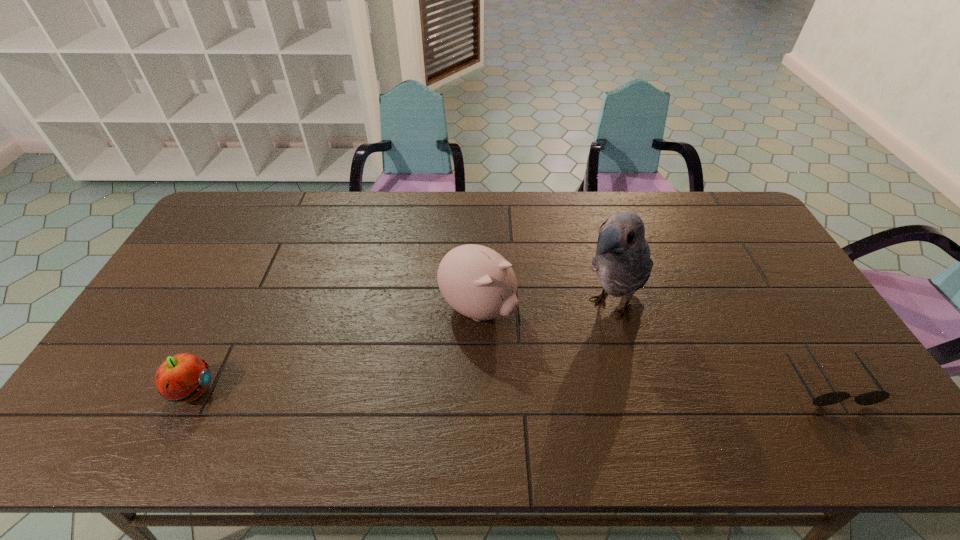
Locate an element on the screen. The height and width of the screenshot is (540, 960). the third tallest object is located at coordinates (184, 377).

You are a GUI agent. You are given a task and a screenshot of the screen. Output one action in this format:
    pyautogui.click(x=<x>, y=<y>)
    Task: Click on the leftmost object
    This screenshot has width=960, height=540.
    Given the screenshot: What is the action you would take?
    pyautogui.click(x=184, y=377)

Where is `sunglasses`? This screenshot has width=960, height=540. sunglasses is located at coordinates (869, 398).

Identify the location of the rightmost object. The image size is (960, 540). (869, 398).

Where is `the third shortest object`? the third shortest object is located at coordinates (476, 281).

Locate an element on the screen. The width and height of the screenshot is (960, 540). the third object from right to left is located at coordinates pos(476,281).

At what (x,y) coordinates should I click in order to perform the action: click on parrot. Please return your answer as a coordinate pair (x, y). Looking at the image, I should click on (622, 262).

The image size is (960, 540). Identify the location of the third object from left to right. (622, 262).

Locate an element on the screen. The image size is (960, 540). vacant space located on the surface of the leftmost object is located at coordinates pos(291,391).

In order to click on free point located 0.320m at the snout of the second object from left to right in this screenshot , I will do `click(605, 397)`.